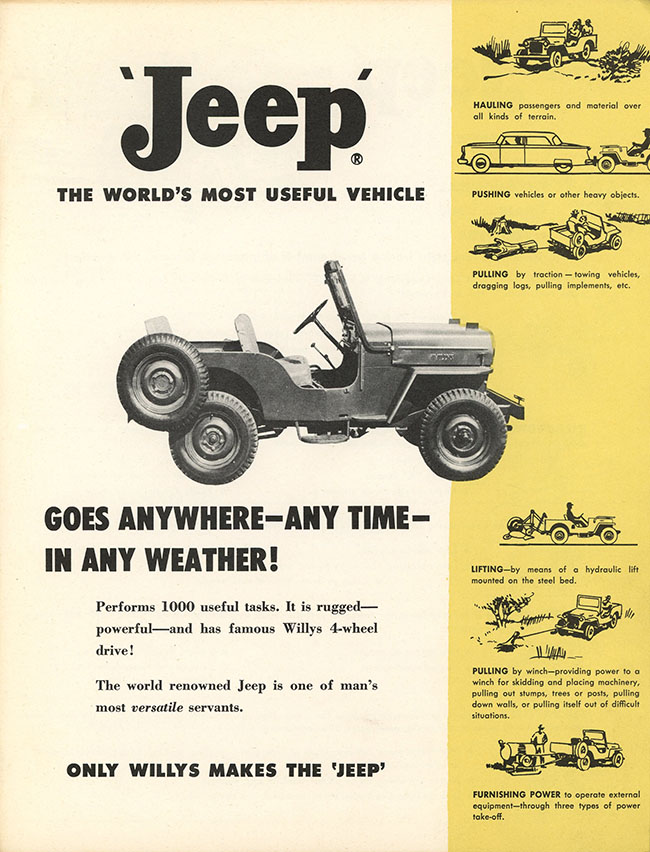
Where is `hood`? This screenshot has width=650, height=852. hood is located at coordinates (417, 326).